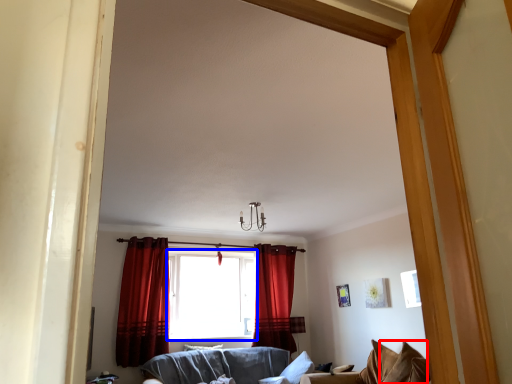
Question: Among these objects, which one is farthest to the camera, pillow (highlighted by a red box) or window (highlighted by a blue box)?

Choices:
 (A) pillow
 (B) window

Answer: (B)